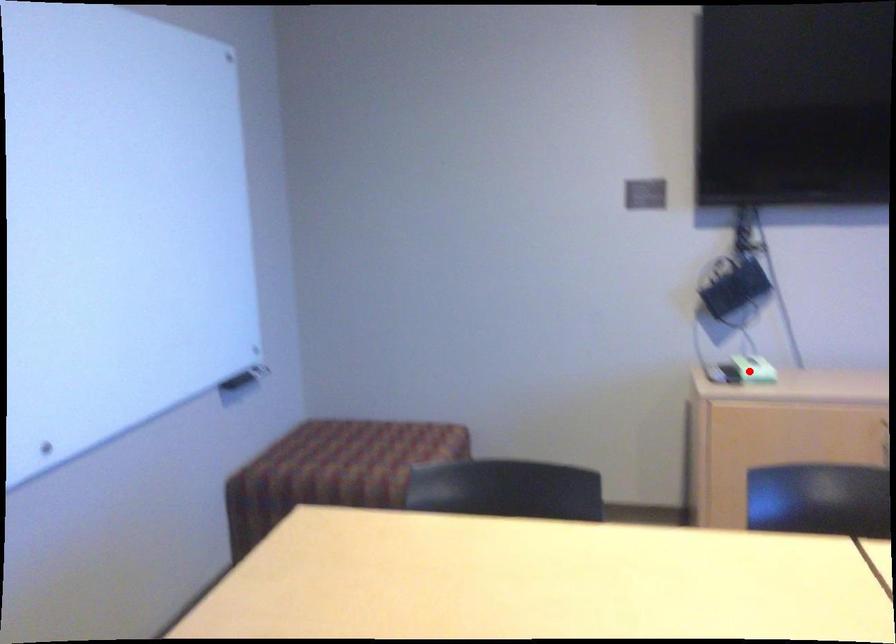
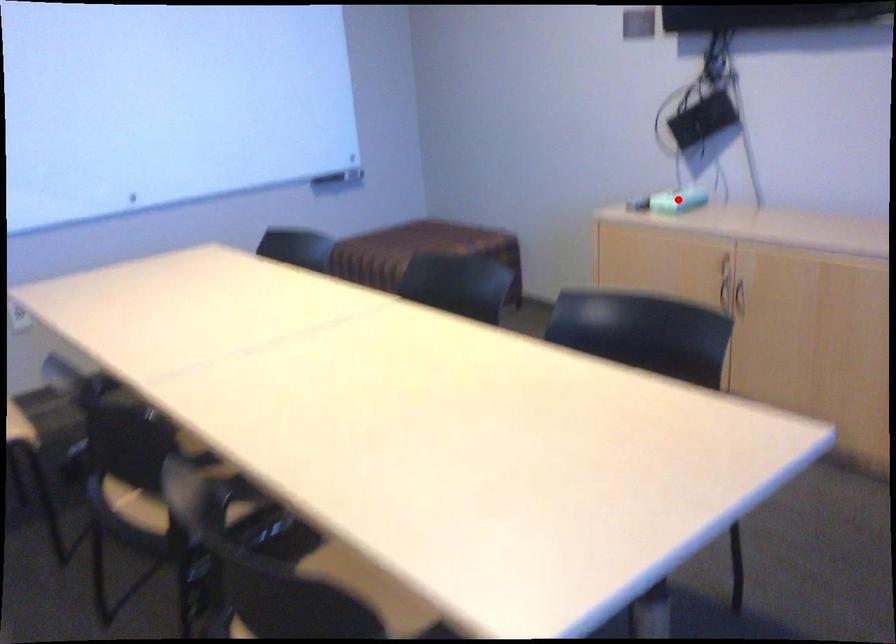
I am providing you with two images of the same scene from different viewpoints. A red point is marked on the first image and another point is marked on the second image. Is the red point in image1 aligned with the point shown in image2?

Yes